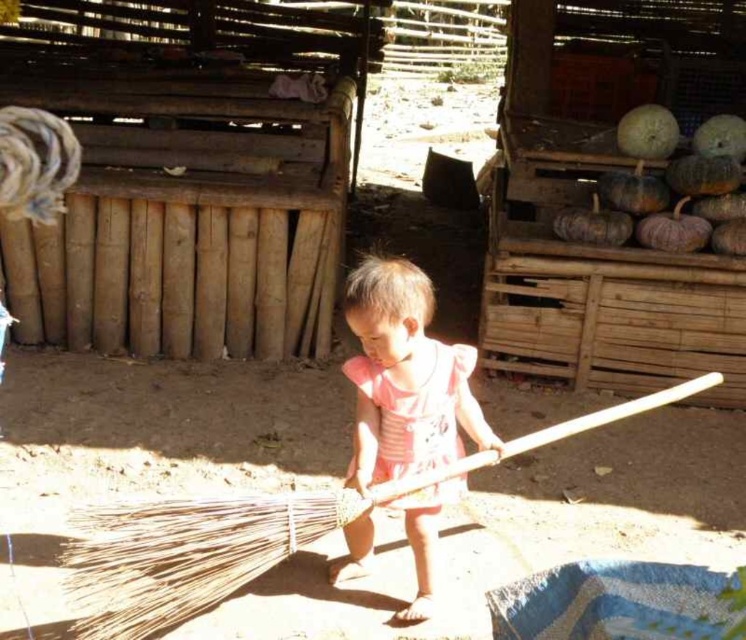
Does point (260, 532) come closer to viewer compared to point (436, 504)?

Yes, point (260, 532) is in front of point (436, 504).

Which of these two, bamboo broom at center or pink fabric dress at center, stands shorter?

With less height is bamboo broom at center.

Who is more distant from viewer, [192,554] or [404,273]?

Positioned behind is point [404,273].

At what (x,y) coordinates should I click in order to perform the action: click on bamboo broom at center. Please return your answer as a coordinate pair (x, y). The width and height of the screenshot is (746, 640). Looking at the image, I should click on (251, 532).